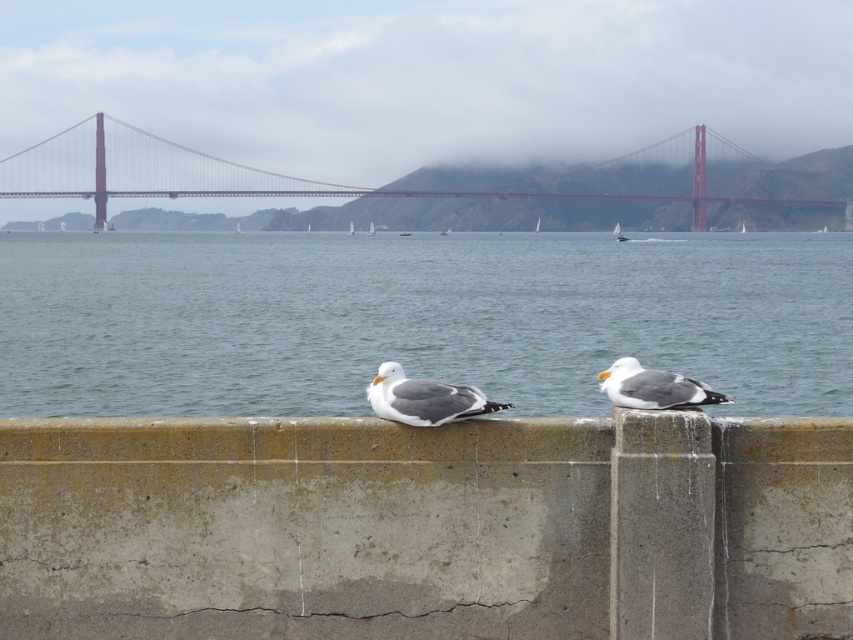
You are standing at the Golden Gate Bridge and see two points marked in the image. Which point is closer to you, point (351, 365) or point (76, 172)?

Point (351, 365) is closer to the viewer than point (76, 172).

You are a photographer planning to capture the Golden Gate Bridge and the surrounding area. You want to ensure that both the blue water at center and the red metal bridge at center are clearly visible in your photo. Based on their sizes in the image, which object should you prioritize framing first to ensure it stands out more prominently?

The red metal bridge at center is wider than the blue water at center, so you should prioritize framing the red metal bridge at center first to ensure it stands out more prominently in the photo.

Consider the image. You are a drone operator trying to capture a photo of the red metal bridge at center. Your drone is currently at coordinates point A. To ensure the bridge is the main focus, you need to position the drone directly above the bridge. What coordinates should you adjust your drone to?

The red metal bridge at center is located at point (293, 177), so you should adjust your drone to those coordinates to be directly above it.